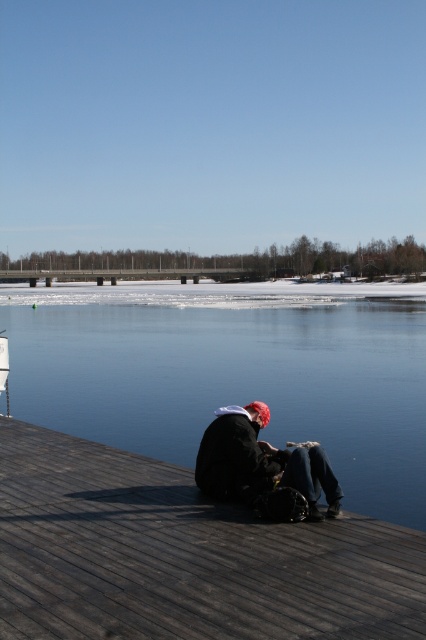
Question: In this image, where is dark wood dock at lower center located relative to matte black jacket at center?

Choices:
 (A) below
 (B) above

Answer: (A)

Question: Which point appears farthest from the camera in this image?

Choices:
 (A) (250, 420)
 (B) (94, 616)
 (C) (195, 422)

Answer: (C)

Question: Does transparent ice at lower center lie in front of matte black jacket at center?

Choices:
 (A) no
 (B) yes

Answer: (A)

Question: Based on their relative distances, which object is nearer to the dark wood dock at lower center?

Choices:
 (A) transparent ice at lower center
 (B) matte black jacket at center

Answer: (B)

Question: From the image, what is the correct spatial relationship of dark wood dock at lower center in relation to matte black jacket at center?

Choices:
 (A) below
 (B) above

Answer: (A)

Question: Which object is farther from the camera taking this photo?

Choices:
 (A) dark wood dock at lower center
 (B) transparent ice at lower center
 (C) matte black jacket at center

Answer: (B)